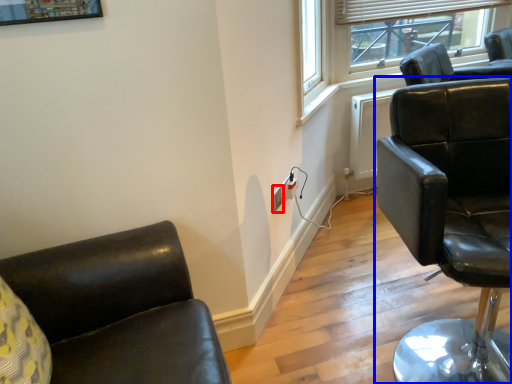
Question: Which of the following is the farthest to the observer, electric outlet (highlighted by a red box) or chair (highlighted by a blue box)?

Choices:
 (A) electric outlet
 (B) chair

Answer: (A)